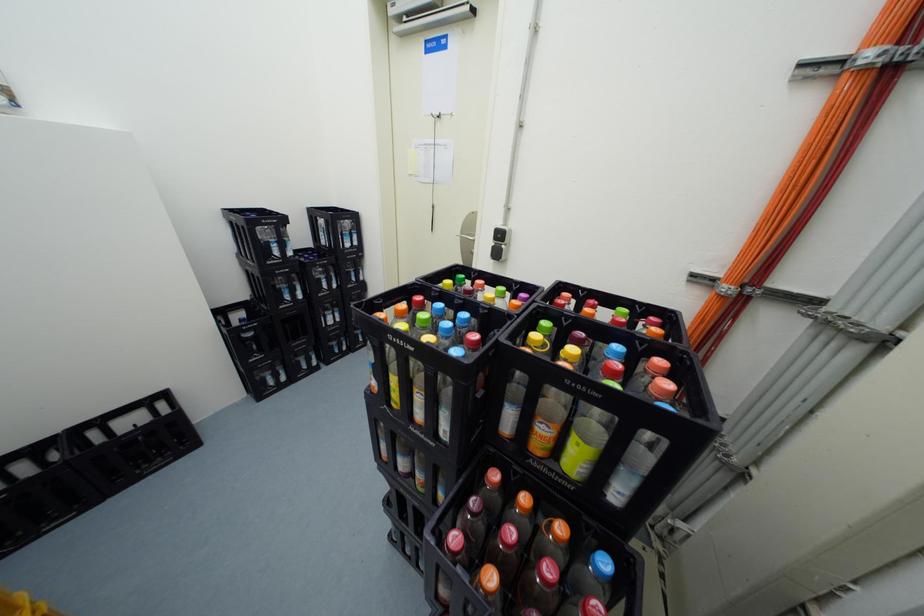
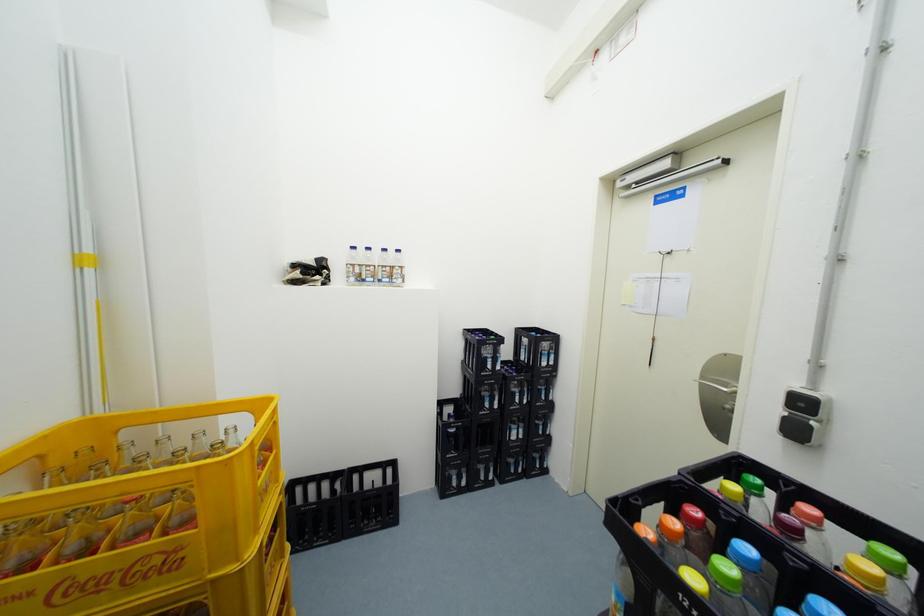
The images are taken continuously from a first-person perspective. In which direction is your viewpoint rotating?

The rotation direction of the camera is left-up.